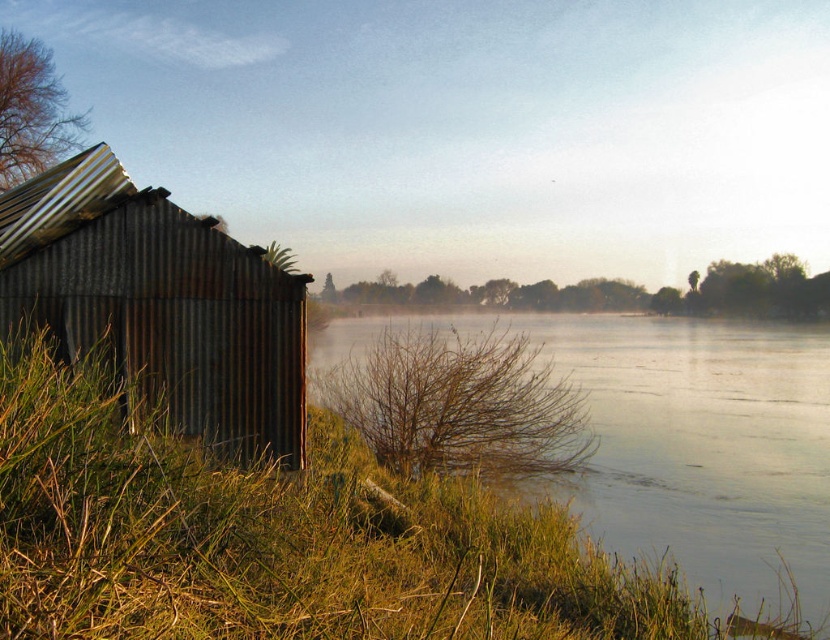
Question: Which object appears closest to the camera in this image?

Choices:
 (A) green grassy river at lower left
 (B) rusty corrugated hut at left

Answer: (A)

Question: Does green grassy river at lower left have a larger size compared to rusty corrugated hut at left?

Choices:
 (A) yes
 (B) no

Answer: (A)

Question: Can you confirm if green grassy river at lower left is positioned above rusty corrugated hut at left?

Choices:
 (A) yes
 (B) no

Answer: (B)

Question: Which point is farther from the camera taking this photo?

Choices:
 (A) (206, 371)
 (B) (775, 563)

Answer: (B)

Question: From the image, what is the correct spatial relationship of green grassy river at lower left in relation to rusty corrugated hut at left?

Choices:
 (A) left
 (B) right

Answer: (B)